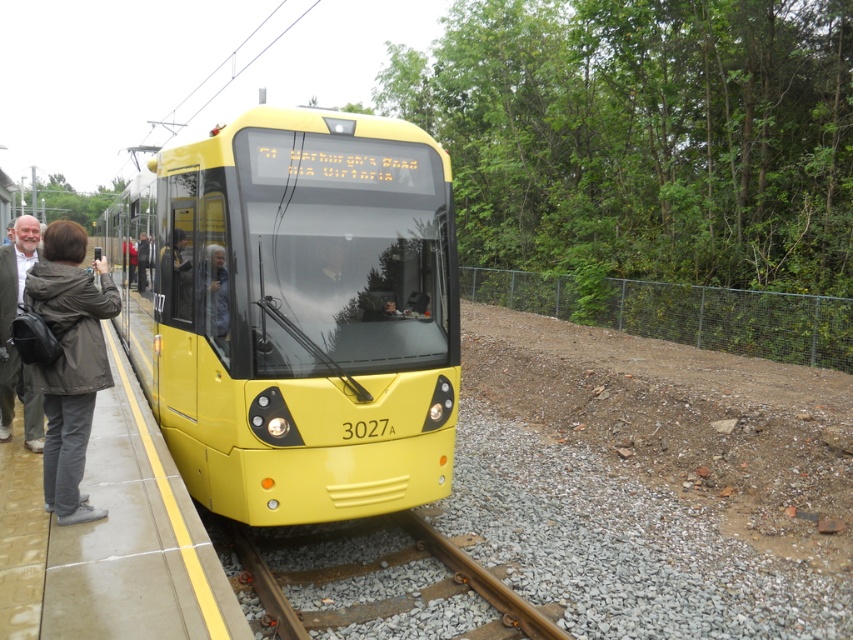
Is brown wooden train track at center shorter than dark gray fabric jacket at left?

Correct, brown wooden train track at center is not as tall as dark gray fabric jacket at left.

Between point (502, 577) and point (49, 260), which one is positioned behind?

The point (502, 577) is more distant.

You are a GUI agent. You are given a task and a screenshot of the screen. Output one action in this format:
    pyautogui.click(x=<x>, y=<y>)
    Task: Click on the brown wooden train track at center
    
    Given the screenshot: What is the action you would take?
    pyautogui.click(x=381, y=570)

Who is positioned more to the right, yellow matte train at center or light brown leather jacket at left?

yellow matte train at center

How distant is yellow matte train at center from light brown leather jacket at left?

yellow matte train at center is 5.70 feet from light brown leather jacket at left.

Does point (358, 429) come farther from viewer compared to point (10, 243)?

No, (358, 429) is closer to viewer.

This screenshot has height=640, width=853. In order to click on yellow matte train at center in this screenshot , I will do `click(294, 312)`.

Is dark gray fabric jacket at left wider than light brown leather jacket at left?

In fact, dark gray fabric jacket at left might be narrower than light brown leather jacket at left.

Which is below, dark gray fabric jacket at left or light brown leather jacket at left?

Positioned lower is light brown leather jacket at left.

Which is behind, point (64, 422) or point (24, 385)?

The point (24, 385) is behind.

Image resolution: width=853 pixels, height=640 pixels. Identify the location of dark gray fabric jacket at left. (68, 362).